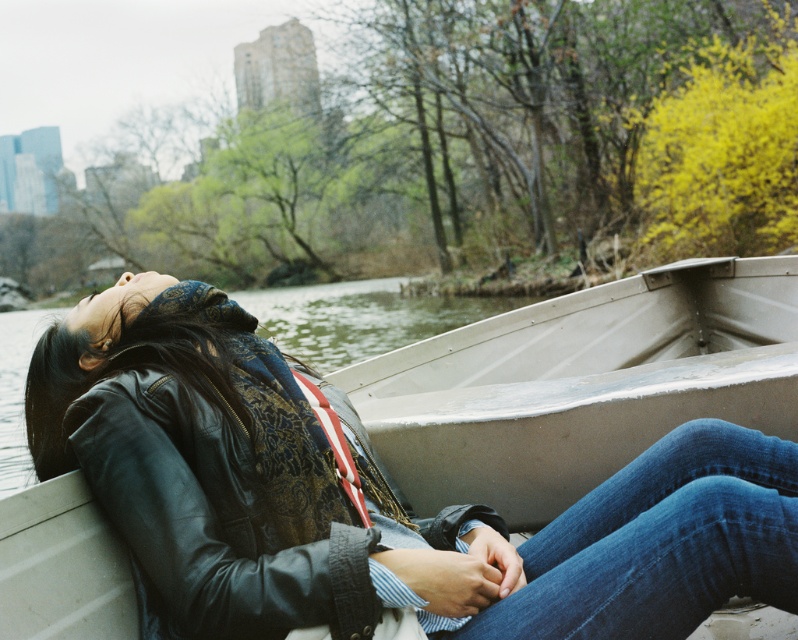
Who is lower down, leather jacket at center or denim at center?

Positioned lower is denim at center.

What do you see at coordinates (206, 518) in the screenshot? I see `leather jacket at center` at bounding box center [206, 518].

I want to click on leather jacket at center, so click(206, 518).

Does metallic gray canoe at center have a smaller size compared to black leather jacket at left?

No.

Is point (401, 424) positioned behind point (377, 608)?

Yes.

Image resolution: width=798 pixels, height=640 pixels. I want to click on metallic gray canoe at center, so click(x=581, y=385).

Does leather jacket at center appear over black leather jacket at left?

Yes, leather jacket at center is above black leather jacket at left.

Which of these two, leather jacket at center or black leather jacket at left, stands shorter?

black leather jacket at left

Describe the element at coordinates (206, 518) in the screenshot. I see `leather jacket at center` at that location.

Locate an element on the screen. This screenshot has height=640, width=798. leather jacket at center is located at coordinates (206, 518).